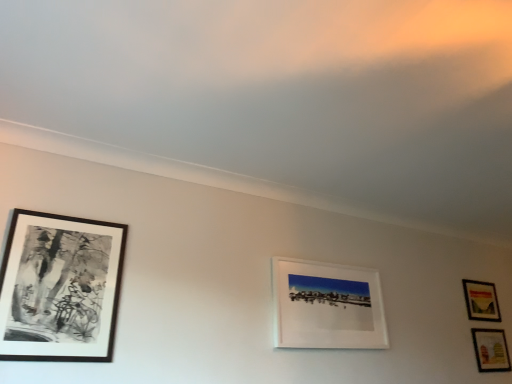
Question: Do you think matte wooden picture frame at lower right, arranged as the 4th picture frame when viewed from the left, is within white matte picture frame at center, which is the second picture frame in left-to-right order, or outside of it?

Choices:
 (A) inside
 (B) outside

Answer: (B)

Question: Considering the positions of matte wooden picture frame at lower right, marked as the 1th picture frame in a right-to-left arrangement, and white matte picture frame at center, arranged as the third picture frame when viewed from the back, in the image, is matte wooden picture frame at lower right, marked as the 1th picture frame in a right-to-left arrangement, wider or thinner than white matte picture frame at center, arranged as the third picture frame when viewed from the back,?

Choices:
 (A) wide
 (B) thin

Answer: (B)

Question: Based on their relative distances, which object is farther from the matte wooden picture frame at right, placed as the second picture frame when sorted from right to left?

Choices:
 (A) matte wooden picture frame at lower right, which is counted as the second picture frame, starting from the back
 (B) black matte picture frame at left, which is the first picture frame from left to right
 (C) white matte picture frame at center, arranged as the third picture frame when viewed from the back

Answer: (B)

Question: Estimate the real-world distances between objects in this image. Which object is farther from the white matte picture frame at center, which is the second picture frame in left-to-right order?

Choices:
 (A) black matte picture frame at left, which is the fourth picture frame in back-to-front order
 (B) matte wooden picture frame at right, the 1th picture frame when ordered from back to front
 (C) matte wooden picture frame at lower right, marked as the 1th picture frame in a right-to-left arrangement

Answer: (C)